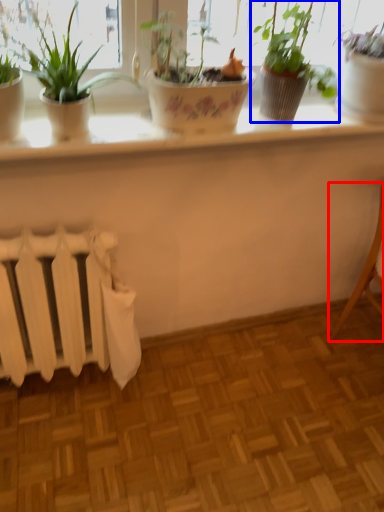
Question: Which object appears closest to the camera in this image, armchair (highlighted by a red box) or houseplant (highlighted by a blue box)?

Choices:
 (A) armchair
 (B) houseplant

Answer: (B)